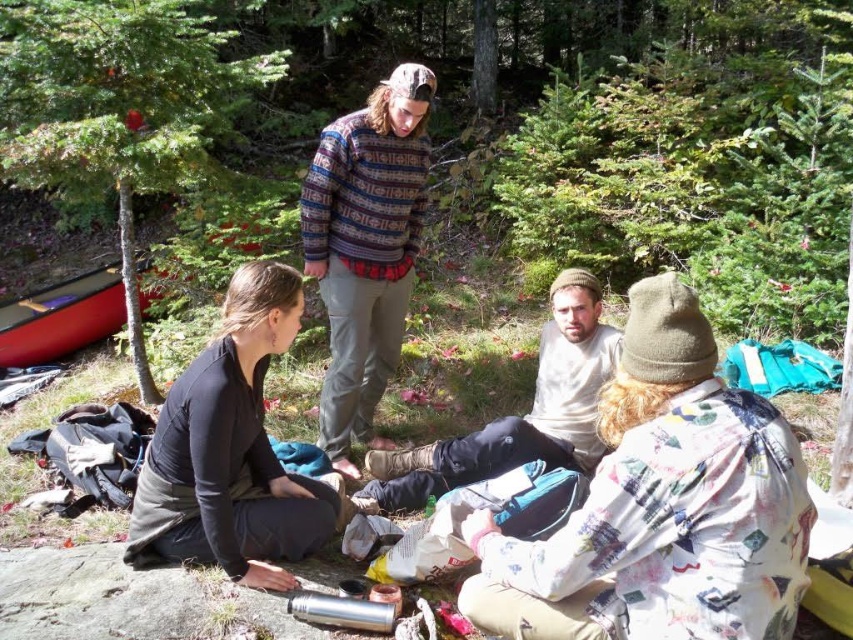
Question: Which point is farther to the camera?

Choices:
 (A) light beige cotton shirt at center
 (B) fluffy beige hat at center
 (C) knitted sweater at center

Answer: (C)

Question: Which object is positioned closest to the knitted sweater at center?

Choices:
 (A) light beige cotton shirt at center
 (B) fluffy beige hat at center
 (C) black matte shirt at lower left
 (D) red plastic canoe at lower left

Answer: (A)

Question: Can you confirm if fluffy beige hat at center is wider than light beige cotton shirt at center?

Choices:
 (A) yes
 (B) no

Answer: (B)

Question: Observing the image, what is the correct spatial positioning of light beige cotton shirt at center in reference to red plastic canoe at lower left?

Choices:
 (A) below
 (B) above

Answer: (A)

Question: Is knitted sweater at center bigger than light beige cotton shirt at center?

Choices:
 (A) yes
 (B) no

Answer: (A)

Question: Which point is closer to the camera?

Choices:
 (A) light beige cotton shirt at center
 (B) red plastic canoe at lower left

Answer: (A)